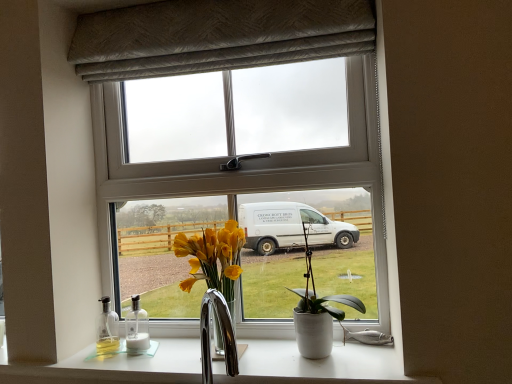
Question: Considering the relative positions of white ceramic pot at center and white glossy countertop at lower center in the image provided, is white ceramic pot at center to the right of white glossy countertop at lower center from the viewer's perspective?

Choices:
 (A) yes
 (B) no

Answer: (A)

Question: Would you say white glossy countertop at lower center is part of white ceramic pot at center's contents?

Choices:
 (A) yes
 (B) no

Answer: (B)

Question: From a real-world perspective, is white ceramic pot at center below white glossy countertop at lower center?

Choices:
 (A) no
 (B) yes

Answer: (A)

Question: Is white ceramic pot at center beside white glossy countertop at lower center?

Choices:
 (A) no
 (B) yes

Answer: (A)

Question: Can you confirm if white ceramic pot at center is bigger than white glossy countertop at lower center?

Choices:
 (A) no
 (B) yes

Answer: (A)

Question: Does white ceramic pot at center have a lesser width compared to white glossy countertop at lower center?

Choices:
 (A) yes
 (B) no

Answer: (A)

Question: Can textured gray curtain at upper center be found inside white glossy bottle at lower left?

Choices:
 (A) yes
 (B) no

Answer: (B)

Question: From a real-world perspective, does white glossy bottle at lower left sit lower than textured gray curtain at upper center?

Choices:
 (A) yes
 (B) no

Answer: (A)

Question: Can you confirm if white glossy bottle at lower left is positioned to the left of textured gray curtain at upper center?

Choices:
 (A) yes
 (B) no

Answer: (A)

Question: Does white glossy bottle at lower left have a lesser width compared to textured gray curtain at upper center?

Choices:
 (A) yes
 (B) no

Answer: (A)

Question: Would you say white glossy bottle at lower left is a long distance from textured gray curtain at upper center?

Choices:
 (A) yes
 (B) no

Answer: (B)

Question: Is white glossy bottle at lower left shorter than textured gray curtain at upper center?

Choices:
 (A) no
 (B) yes

Answer: (B)

Question: Is white glossy bottle at lower left aimed at white plastic window at center?

Choices:
 (A) no
 (B) yes

Answer: (A)